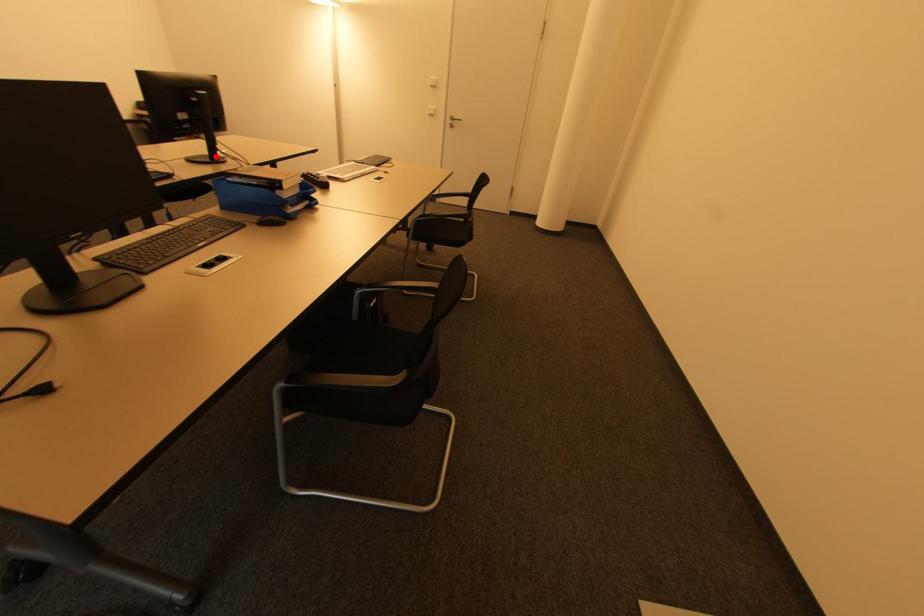
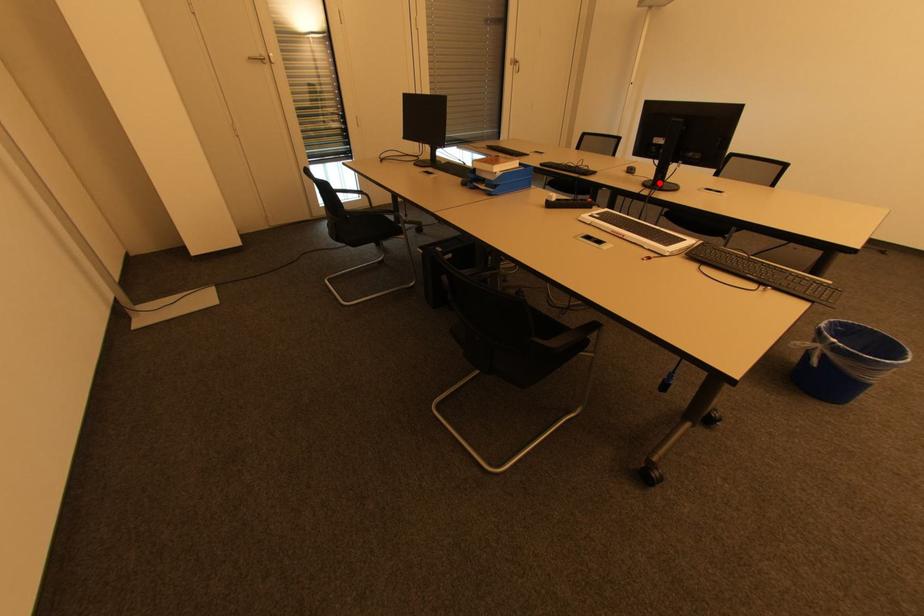
I am providing you with two images of the same scene from different viewpoints. A red point is marked on the first image and another point is marked on the second image. Is the red point in image1 aligned with the point shown in image2?

Yes